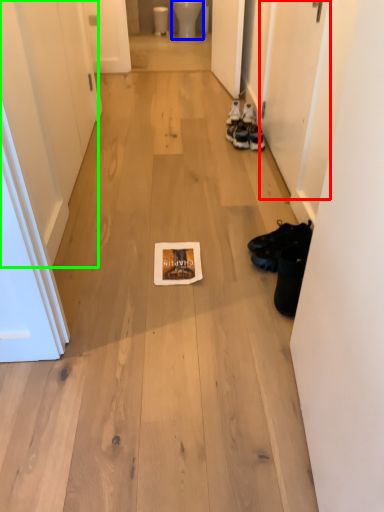
Question: Which object is positioned farthest from door (highlighted by a red box)? Select from toilet bowl (highlighted by a blue box) and door (highlighted by a green box).

Choices:
 (A) toilet bowl
 (B) door

Answer: (A)